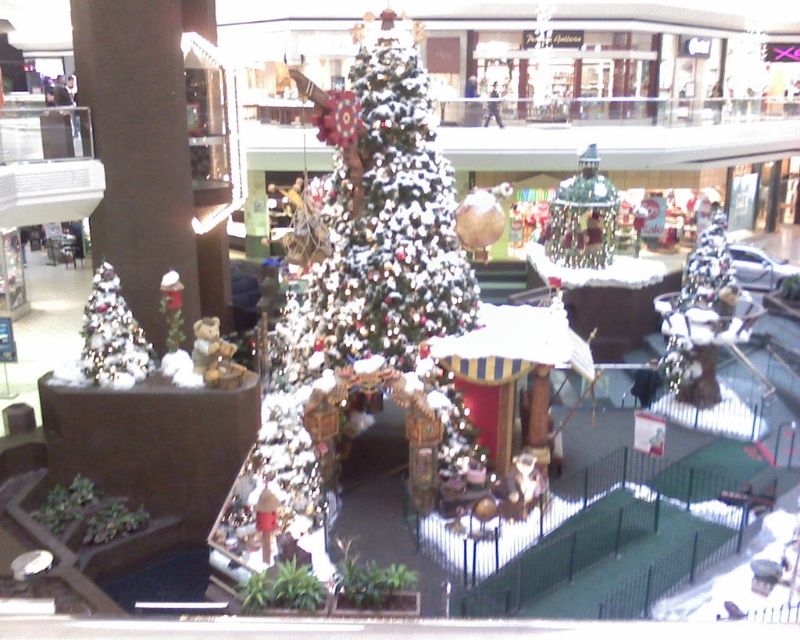
Does metallic silver ornament at center have a smaller size compared to white glittery christmas tree at lower left?

No, metallic silver ornament at center is not smaller than white glittery christmas tree at lower left.

Does point (570, 243) lie in front of point (100, 321)?

That is False.

Which is in front, point (576, 173) or point (126, 342)?

Positioned in front is point (126, 342).

Locate an element on the screen. This screenshot has width=800, height=640. metallic silver ornament at center is located at coordinates (582, 218).